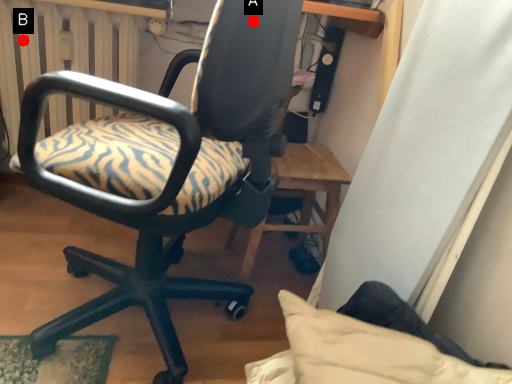
Question: Two points are circled on the image, labeled by A and B beside each circle. Which point is closer to the camera?

Choices:
 (A) A is closer
 (B) B is closer

Answer: (A)